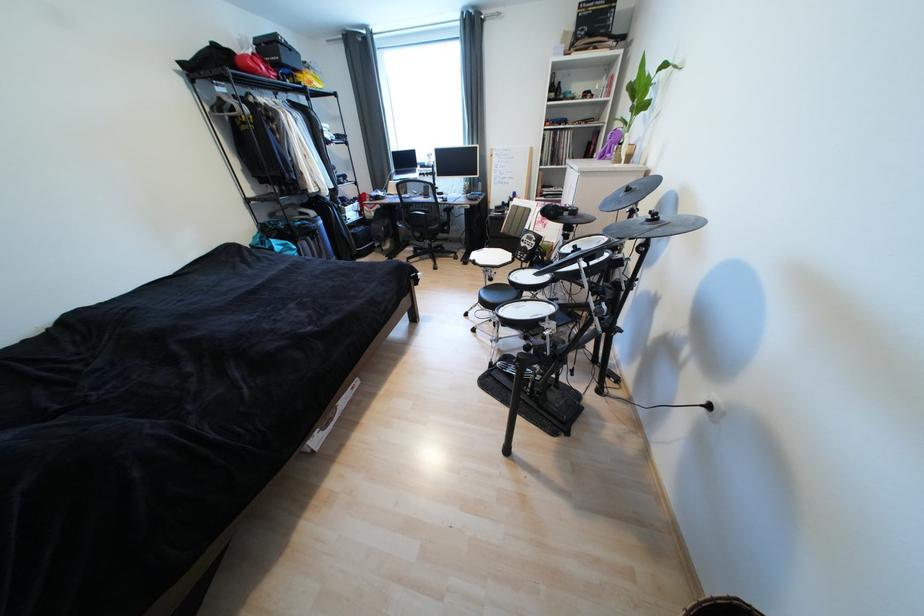
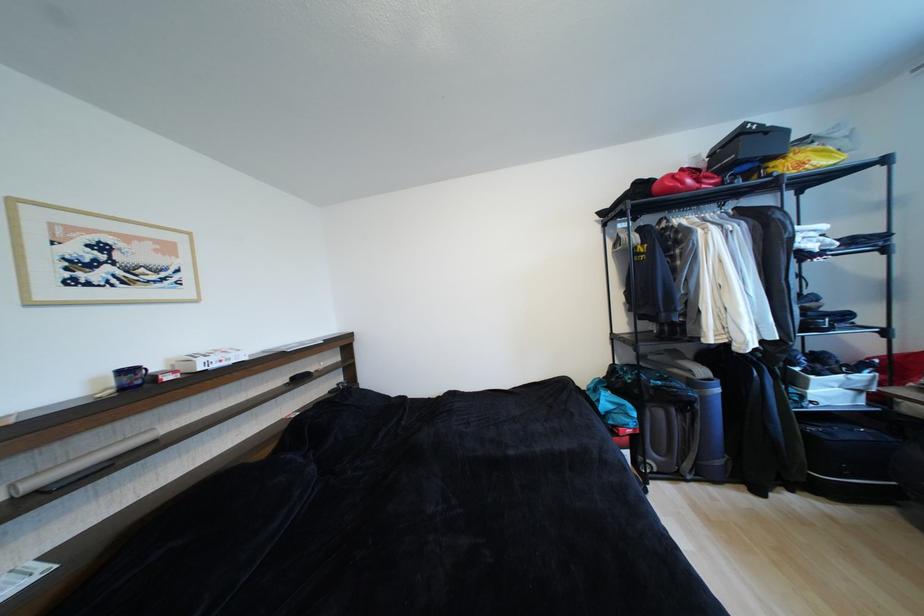
Where in the second image is the point corresponding to (261,73) from the first image?

(676, 192)